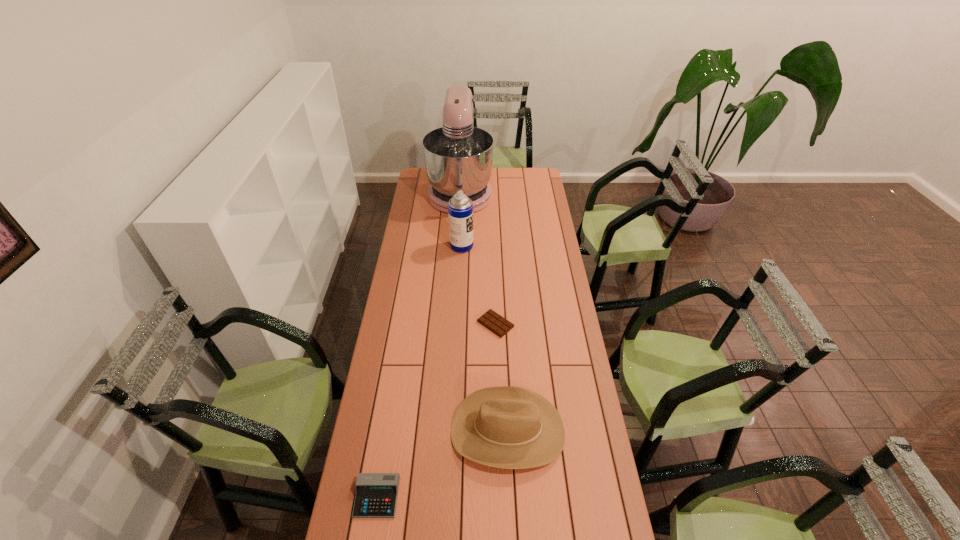
Where is `mixer`? The image size is (960, 540). mixer is located at coordinates (458, 156).

I want to click on the farthest object, so click(x=458, y=156).

The height and width of the screenshot is (540, 960). Find the location of `aerosol can`. aerosol can is located at coordinates (460, 208).

Locate an element on the screen. This screenshot has width=960, height=540. the fourth nearest object is located at coordinates (460, 208).

The width and height of the screenshot is (960, 540). I want to click on cowboy hat, so tap(509, 427).

Locate an element on the screen. This screenshot has width=960, height=540. the third shortest object is located at coordinates (509, 427).

I want to click on calculator, so click(376, 495).

Identify the location of the nearest object. (376, 495).

This screenshot has height=540, width=960. In order to click on the shortest object in this screenshot , I will do `click(494, 322)`.

In order to click on the third farthest object in this screenshot , I will do `click(494, 322)`.